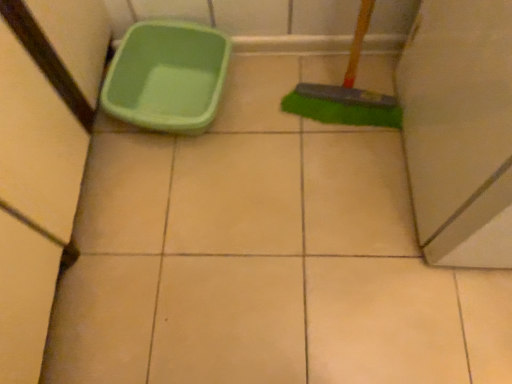
What do you see at coordinates (167, 76) in the screenshot? Image resolution: width=512 pixels, height=384 pixels. I see `green plastic tray at upper left` at bounding box center [167, 76].

At what (x,y) coordinates should I click in order to perform the action: click on green plastic tray at upper left. Please return your answer as a coordinate pair (x, y). The image size is (512, 384). Looking at the image, I should click on point(167,76).

Locate an element on the screen. The width and height of the screenshot is (512, 384). green plastic tray at upper left is located at coordinates (167, 76).